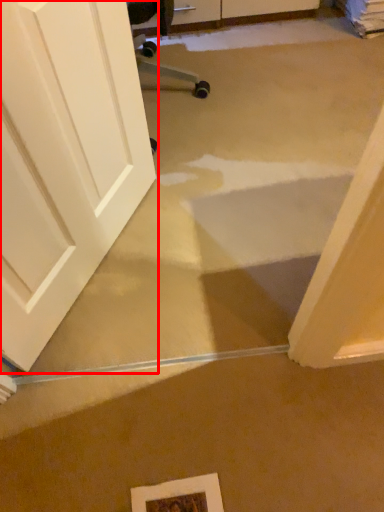
Question: From the image's perspective, where is door (annotated by the red box) located in relation to picture frame in the image?

Choices:
 (A) above
 (B) below

Answer: (A)